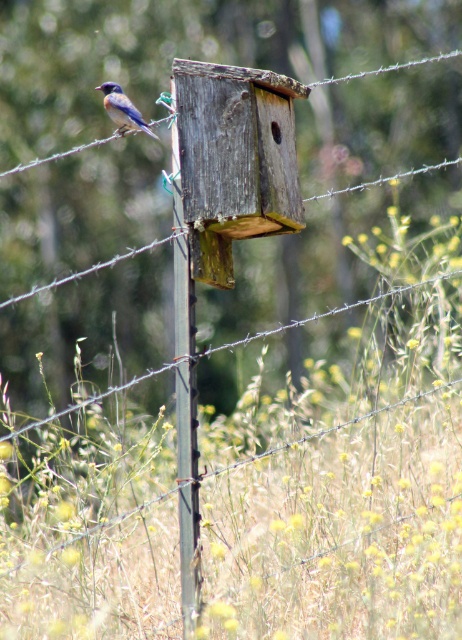
Question: Does weathered wood bird feeder at center have a larger size compared to blue glossy bird at upper left?

Choices:
 (A) no
 (B) yes

Answer: (B)

Question: Does weathered wood bird feeder at center have a greater width compared to blue glossy bird at upper left?

Choices:
 (A) yes
 (B) no

Answer: (A)

Question: Which of the following is the farthest from the observer?

Choices:
 (A) (129, 120)
 (B) (265, 200)

Answer: (A)

Question: Is weathered wood bird feeder at center thinner than blue glossy bird at upper left?

Choices:
 (A) no
 (B) yes

Answer: (A)